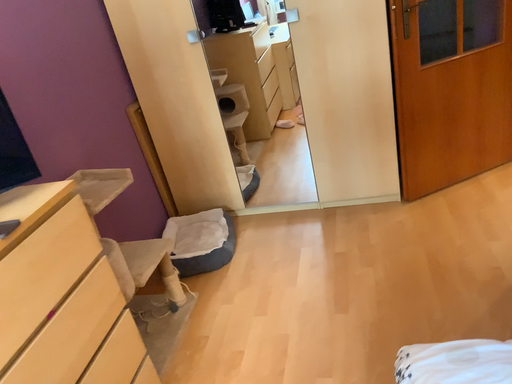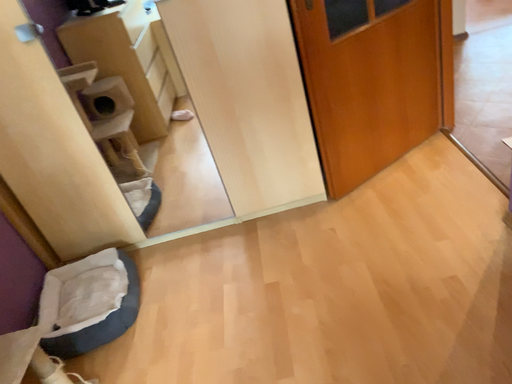
Question: Which way did the camera rotate in the video?

Choices:
 (A) rotated left
 (B) rotated right

Answer: (B)